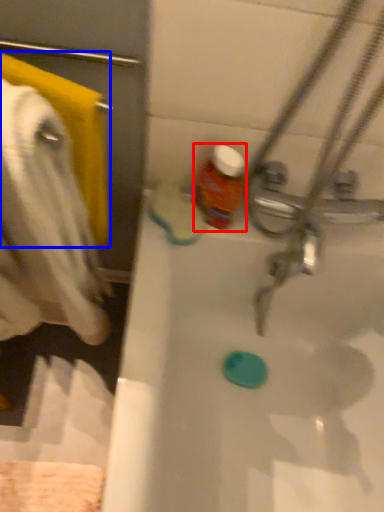
Question: Which object appears closest to the camera in this image, bottle (highlighted by a red box) or towel/napkin (highlighted by a blue box)?

Choices:
 (A) bottle
 (B) towel/napkin

Answer: (B)